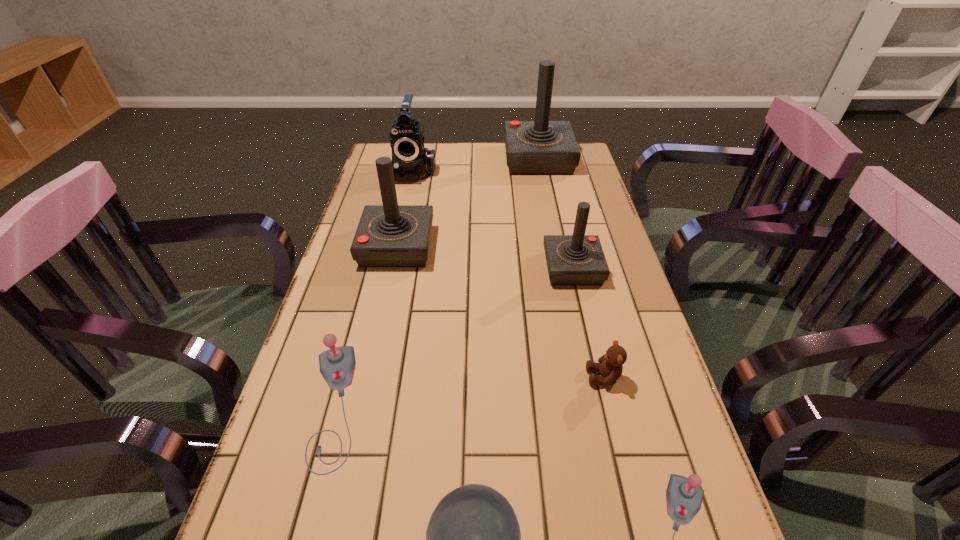
Where is `free location located on the rectangular base of the farthest joystick`? The image size is (960, 540). free location located on the rectangular base of the farthest joystick is located at coordinates (551, 225).

Locate an element on the screen. The width and height of the screenshot is (960, 540). free location located 0.250m on the rectangular base of the second tallest joystick is located at coordinates coord(518,247).

Find the location of a particular element. This screenshot has height=540, width=960. vacant area located on the lens mount of the camcorder is located at coordinates (399, 225).

Find the location of a particular element. The width and height of the screenshot is (960, 540). vacant position located 0.050m on the rectangular base of the third tallest joystick is located at coordinates (527, 268).

This screenshot has height=540, width=960. What are the coordinates of `free space located on the rectangular base of the third tallest joystick` in the screenshot? It's located at (527, 268).

Identify the location of vacant space located on the rectangular base of the third tallest joystick. (418, 268).

Image resolution: width=960 pixels, height=540 pixels. In order to click on free space located 0.130m on the back of the bigger gray joystick in this screenshot , I will do `click(359, 309)`.

In order to click on blank space located 0.380m on the face of the teddy bear in this screenshot , I will do `click(411, 377)`.

Where is `vacant area situated on the face of the teddy bear`? vacant area situated on the face of the teddy bear is located at coordinates (564, 377).

The width and height of the screenshot is (960, 540). I want to click on vacant space located on the face of the teddy bear, so click(x=452, y=377).